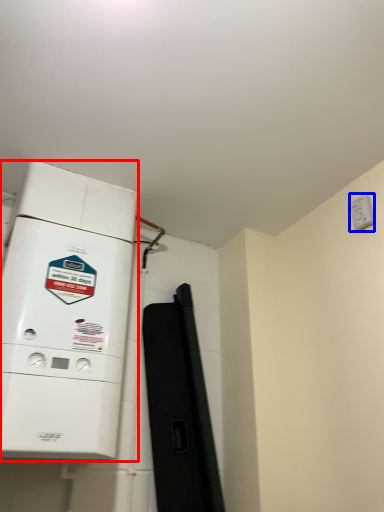
Question: Which of the following is the closest to the observer, home appliance (highlighted by a red box) or electric outlet (highlighted by a blue box)?

Choices:
 (A) home appliance
 (B) electric outlet

Answer: (A)